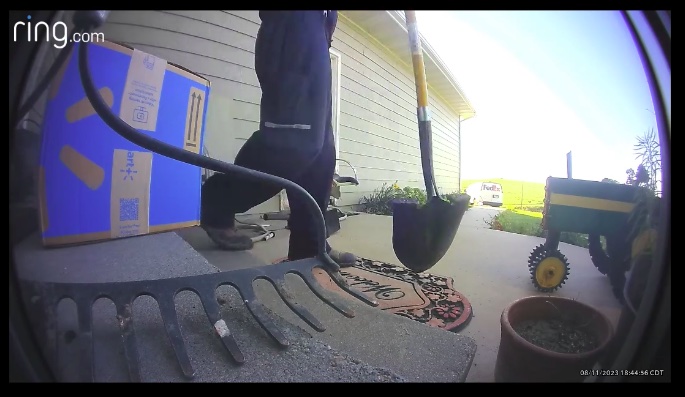
Image resolution: width=685 pixels, height=397 pixels. I want to click on grey doormat, so click(162, 259).